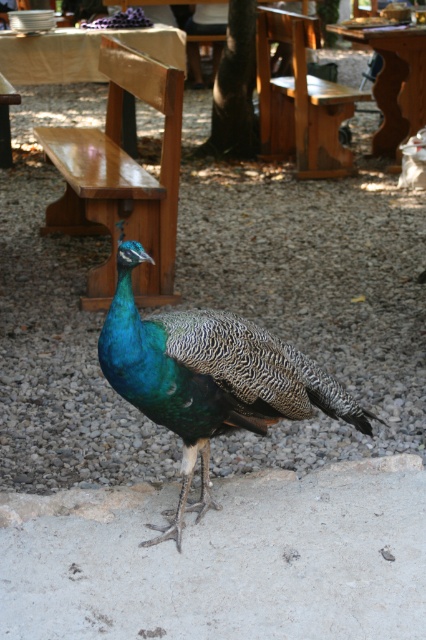
Does wooden park bench at center appear on the left side of wooden picnic table at center?

Indeed, wooden park bench at center is positioned on the left side of wooden picnic table at center.

Is wooden park bench at center thinner than wooden picnic table at center?

Yes.

Is point (261, 20) farther from viewer compared to point (385, 77)?

No.

The height and width of the screenshot is (640, 426). Identify the location of wooden park bench at center. (301, 100).

Does shiny wood bench at center have a greater height compared to wooden park bench at center?

Yes.

Measure the distance between shiny wood bench at center and wooden park bench at center.

The distance of shiny wood bench at center from wooden park bench at center is 6.99 feet.

Who is more forward, (106, 298) or (339, 141)?

Positioned in front is point (106, 298).

Where is `shiny wood bench at center`? This screenshot has height=640, width=426. shiny wood bench at center is located at coordinates (121, 179).

Find the location of a particular element. The image size is (426, 640). gray gravel at center is located at coordinates (311, 289).

Is the position of gray gravel at center more distant than that of wooden picnic table at center?

No, it is in front of wooden picnic table at center.

Between point (356, 433) and point (393, 77), which one is positioned in front?

Point (356, 433)

The height and width of the screenshot is (640, 426). What are the coordinates of `gray gravel at center` in the screenshot? It's located at (311, 289).